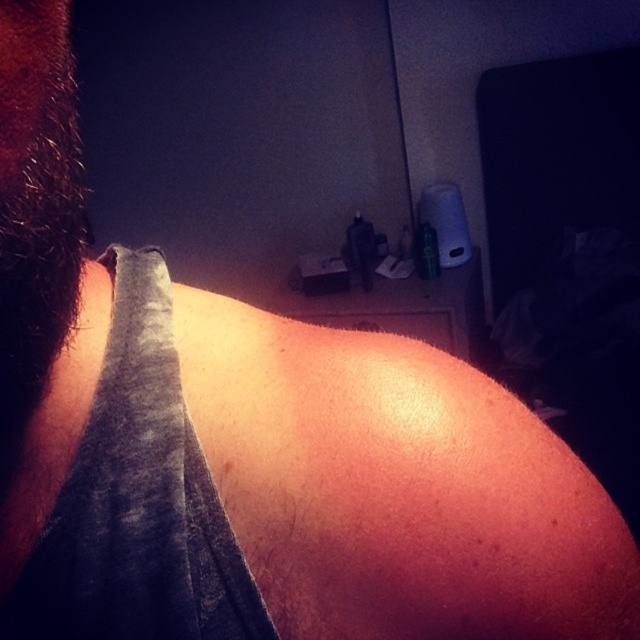
Is gray cotton shirt at left positioned at the back of hairy skin at left?

No.

Who is shorter, gray cotton shirt at left or hairy skin at left?

hairy skin at left

This screenshot has height=640, width=640. What do you see at coordinates (136, 500) in the screenshot?
I see `gray cotton shirt at left` at bounding box center [136, 500].

Locate an element on the screen. gray cotton shirt at left is located at coordinates (136, 500).